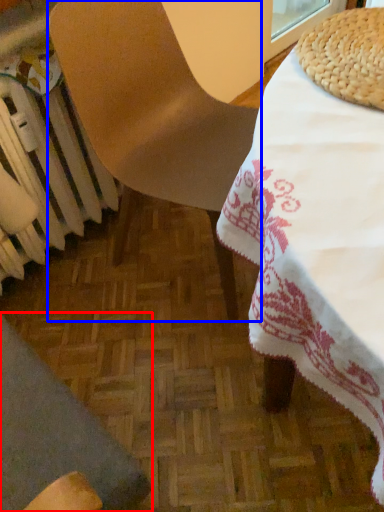
Question: Which point is further to the camera, chair (highlighted by a red box) or chair (highlighted by a blue box)?

Choices:
 (A) chair
 (B) chair

Answer: (B)